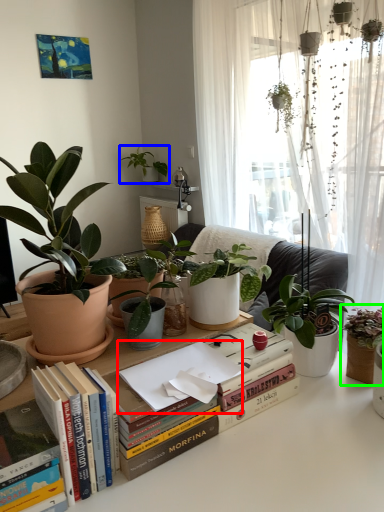
Question: Estimate the real-world distances between objects in this image. Which object is farther from paperback book (highlighted by a red box), houseplant (highlighted by a blue box) or houseplant (highlighted by a green box)?

Choices:
 (A) houseplant
 (B) houseplant

Answer: (A)